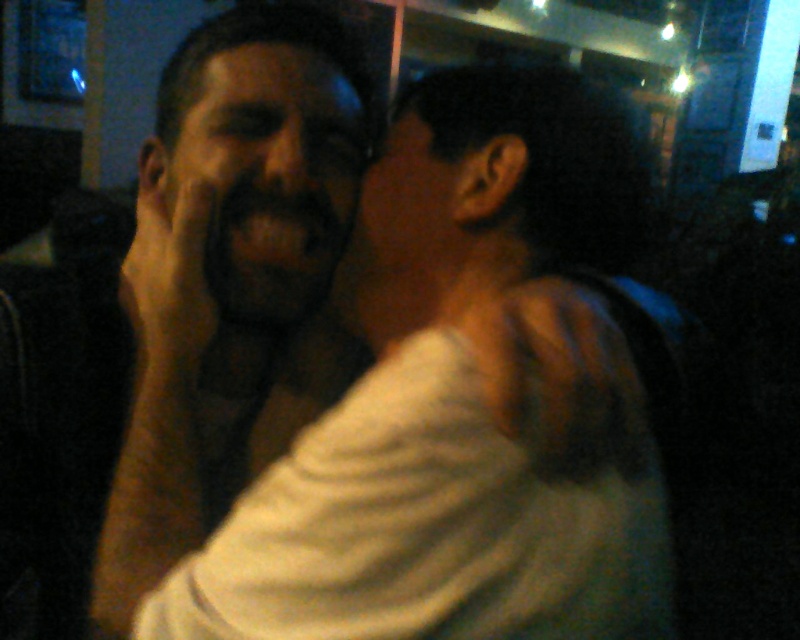
Question: Which point is closer to the camera?

Choices:
 (A) (580, 413)
 (B) (186, 163)

Answer: (A)

Question: Is matte white shirt at center in front of dark matte face at center?

Choices:
 (A) yes
 (B) no

Answer: (A)

Question: Where is matte white shirt at center located in relation to dark matte face at center in the image?

Choices:
 (A) right
 (B) left

Answer: (A)

Question: Can you confirm if matte white shirt at center is positioned above dark matte face at center?

Choices:
 (A) yes
 (B) no

Answer: (B)

Question: Among these objects, which one is nearest to the camera?

Choices:
 (A) matte white shirt at center
 (B) dark matte face at center

Answer: (A)